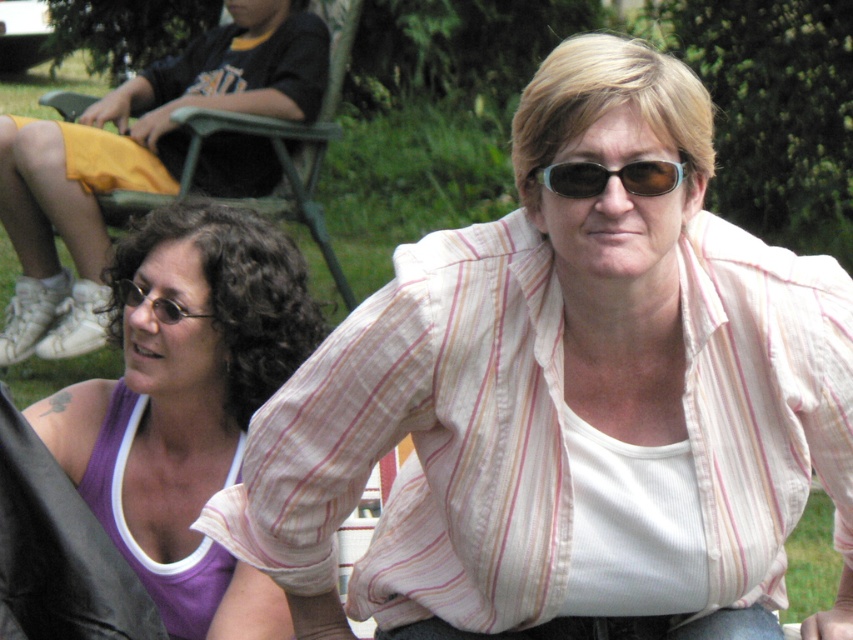
Question: Considering the real-world distances, which object is closest to the purple fabric tank top at left?

Choices:
 (A) pink striped shirt at center
 (B) matte black glasses at lower left
 (C) sunglasses at center

Answer: (B)

Question: Is pink striped shirt at center to the right of matte black glasses at lower left from the viewer's perspective?

Choices:
 (A) no
 (B) yes

Answer: (B)

Question: Among these points, which one is nearest to the camera?

Choices:
 (A) (578, 189)
 (B) (109, 285)
 (C) (544, 444)

Answer: (A)

Question: Can you confirm if green plastic chair at upper left is wider than matte black glasses at lower left?

Choices:
 (A) yes
 (B) no

Answer: (A)

Question: Which object is closer to the camera taking this photo?

Choices:
 (A) pink striped shirt at center
 (B) purple fabric tank top at left
 (C) matte black glasses at lower left
 (D) sunglasses at center

Answer: (D)

Question: Is pink striped shirt at center in front of purple fabric tank top at left?

Choices:
 (A) yes
 (B) no

Answer: (A)